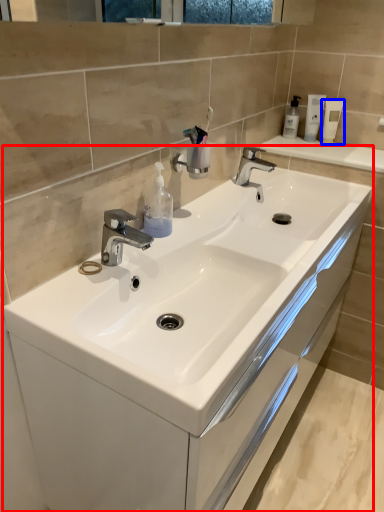
Question: Which object is further to the camera taking this photo, bathroom cabinet (highlighted by a red box) or mouthwash (highlighted by a blue box)?

Choices:
 (A) bathroom cabinet
 (B) mouthwash

Answer: (B)